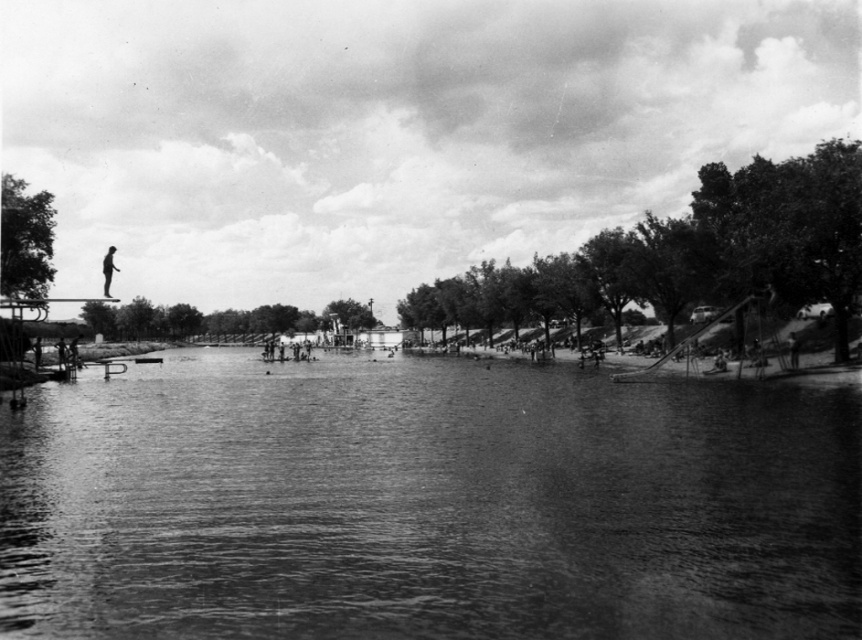
You are a photographer aiming to capture the silhouette figure at left and the smooth water at center in your shot. Based on their positions, where should you position your camera relative to the scene?

The smooth water at center is below the silhouette figure at left, so you should position your camera below the silhouette figure at left to capture both the silhouette figure at left and the smooth water at center in the same frame.

You are standing at the edge of the pool and want to reach both the point at coordinates point (786,428) and point (117,269). Which point should you walk towards first if you want to reach the one closer to you first?

You should walk towards point (786,428) first because it is closer to you than point (117,269).

You are a photographer standing at the edge of the pool and want to capture a photo of the silhouette figure at left and the smooth water at center. Which object will appear larger in your photo?

The smooth water at center will appear larger in the photo because it is closer to the viewer than the silhouette figure at left.